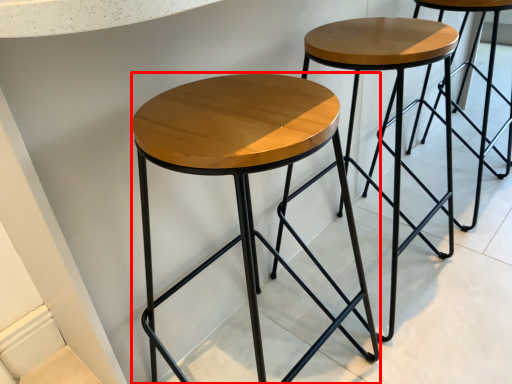
Question: From the image's perspective, where is stool (annotated by the red box) located in relation to stool in the image?

Choices:
 (A) above
 (B) below

Answer: (B)